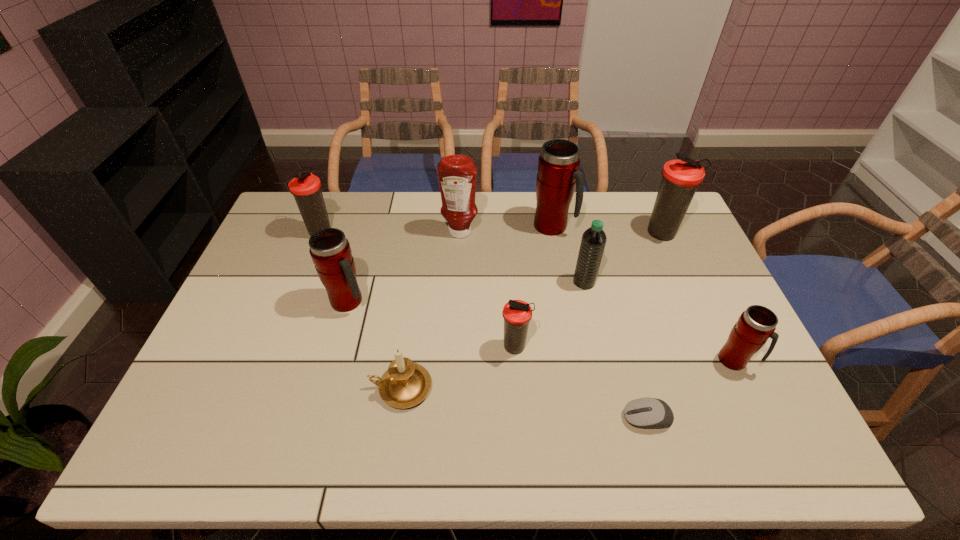
You are a GUI agent. You are given a task and a screenshot of the screen. Output one action in this format:
    pyautogui.click(x=<x>, y=<y>)
    Task: Click on the thermos bottle that is the second closest to the nearest brown thermos bottle
    The height and width of the screenshot is (540, 960).
    Given the screenshot: What is the action you would take?
    pyautogui.click(x=558, y=175)

At what (x,y) coordinates should I click in order to perform the action: click on thermos bottle that is the closest to the rightmost brown thermos bottle. Please return your answer as a coordinate pair (x, y). Looking at the image, I should click on (558, 175).

The image size is (960, 540). I want to click on brown thermos bottle that is the nearest to the computer equipment, so click(x=516, y=313).

Identify the location of the closest brown thermos bottle to the fifth thermos bottle from right to left. (306, 188).

I want to click on red thermos bottle that is the second closest to the leftmost thermos bottle, so click(x=558, y=175).

Choose which red thermos bottle is the second nearest neighbor to the farthest red thermos bottle. Please provide its 2D coordinates. Your answer should be formatted as a tuple, i.e. [(x, y)], where the tuple contains the x and y coordinates of a point satisfying the conditions above.

[(330, 251)]

Find the location of `free space that satisfies the following two spatial constraints: 1. on the front side of the nearest brown thermos bottle; 2. with a handle on the side of the candle holder`. free space that satisfies the following two spatial constraints: 1. on the front side of the nearest brown thermos bottle; 2. with a handle on the side of the candle holder is located at coordinates (517, 388).